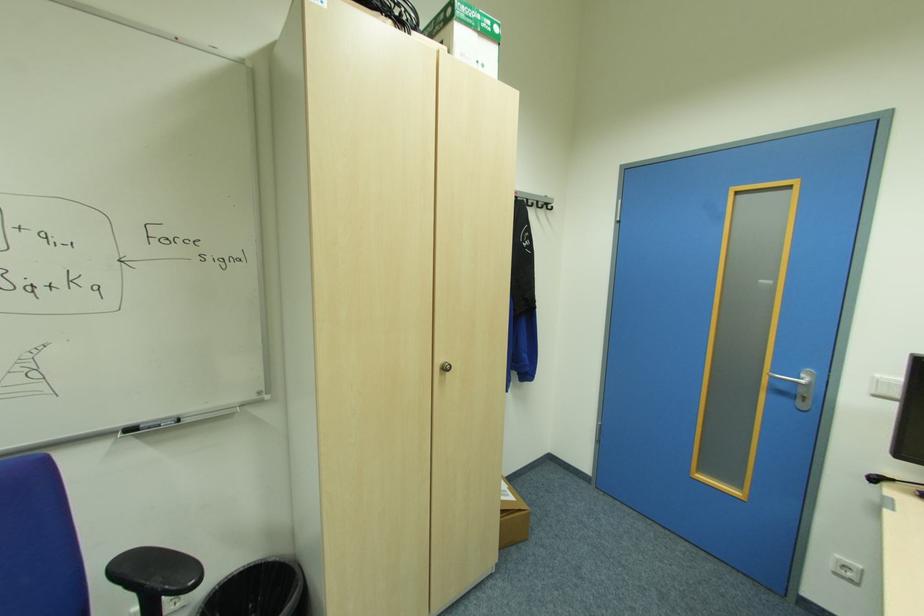
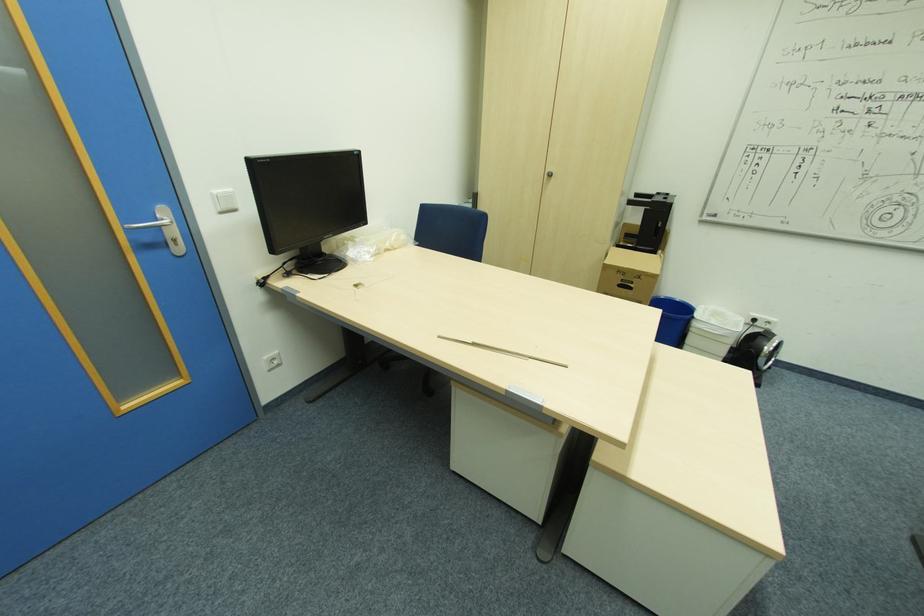
In the second image, find the point that corresponds to [879,375] in the first image.

(216, 191)